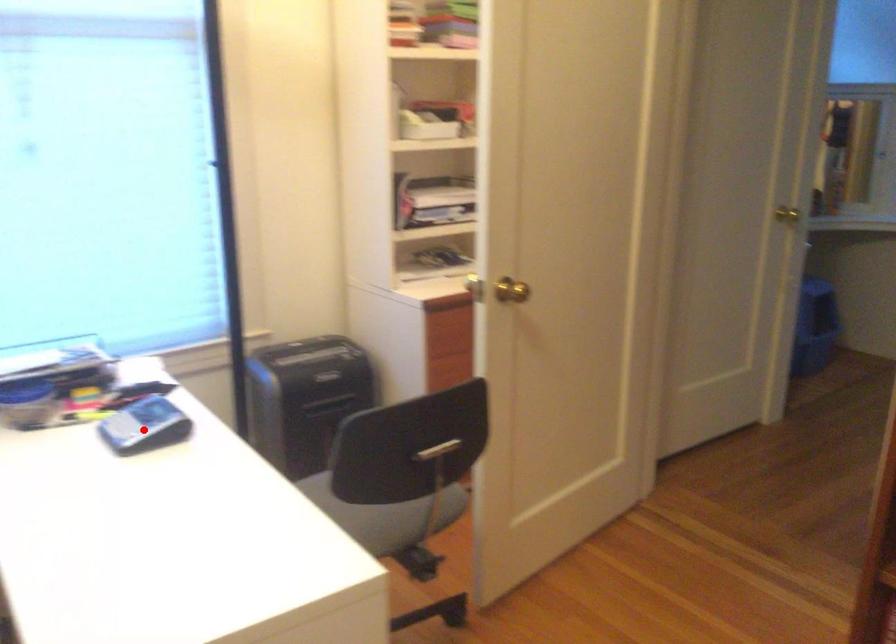
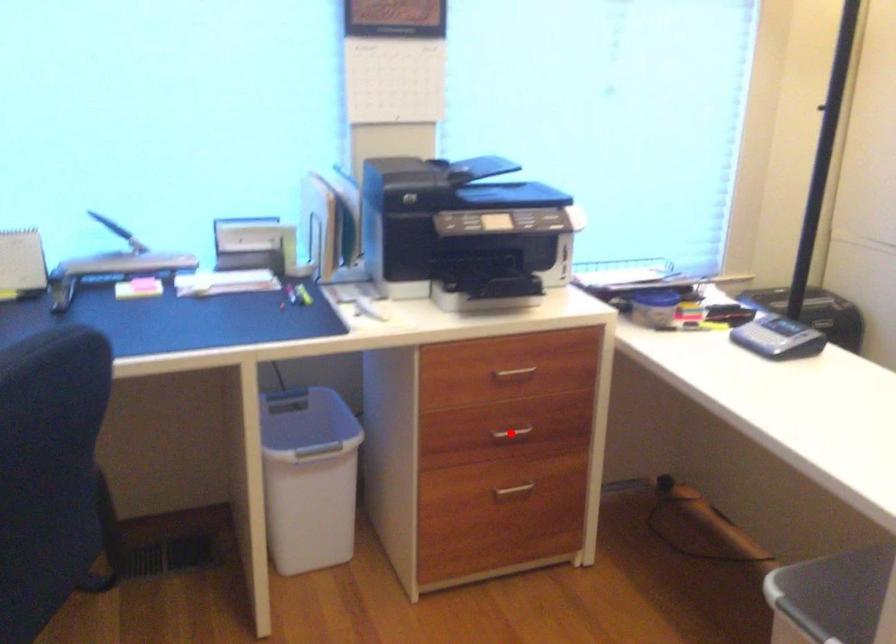
I am providing you with two images of the same scene from different viewpoints. A red point is marked on the first image and another point is marked on the second image. Does the point marked in image1 correspond to the same location as the one in image2?

No